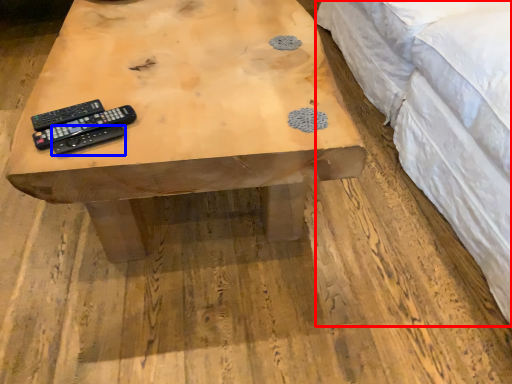
Question: Which of the following is the farthest to the observer, bed (highlighted by a red box) or remote control (highlighted by a blue box)?

Choices:
 (A) bed
 (B) remote control

Answer: (B)